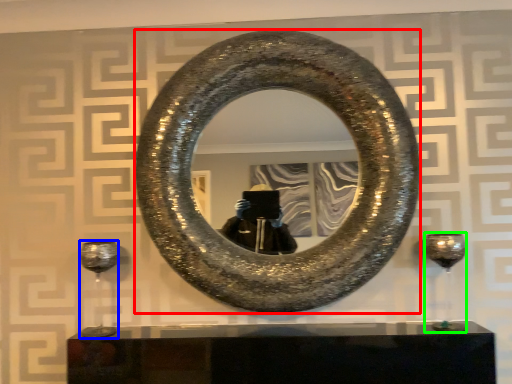
Question: Which object is positioned farthest from horseshoe (highlighted by a red box)? Select from wine glass (highlighted by a blue box) and wine glass (highlighted by a green box).

Choices:
 (A) wine glass
 (B) wine glass

Answer: (A)